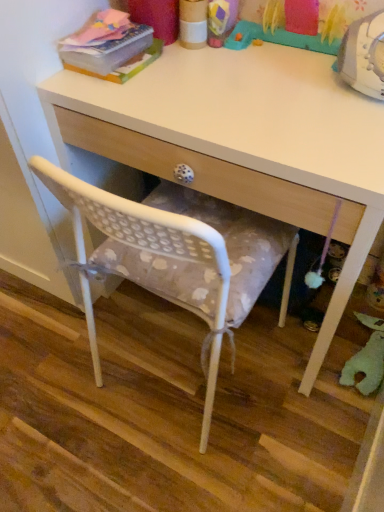
I want to click on vacant space situated above white wood desk at center (from a real-world perspective), so click(x=244, y=86).